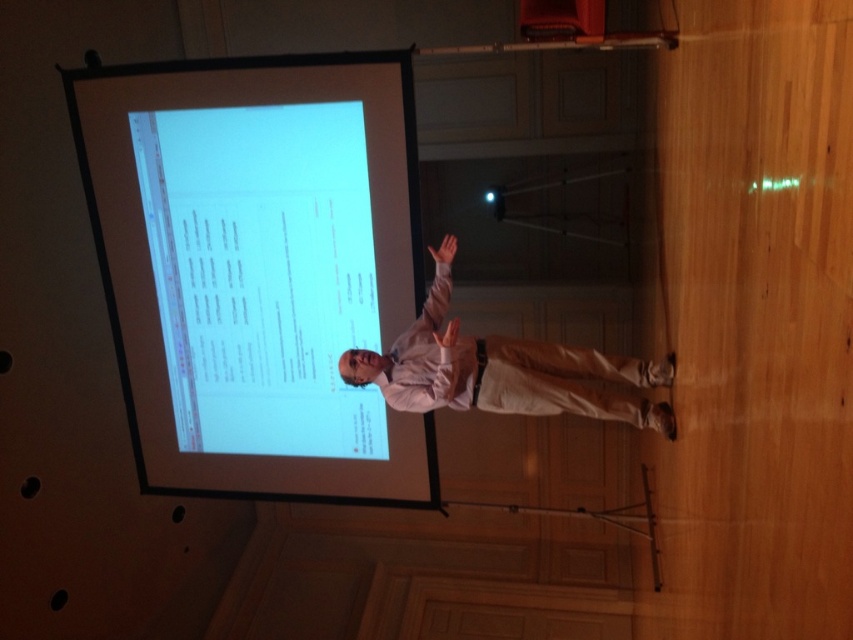
You are an event planner setting up a new projector. The projector needs to be placed at a position that can project onto the point marked as point (257, 268). Where should you aim the projector to hit the white glossy projection screen at upper center?

The point (257, 268) marks the white glossy projection screen at upper center, so you should aim the projector at the white glossy projection screen at upper center to hit the desired point.

You are an event coordinator setting up a new projector. The projector needs to be placed at point 0.5, 0.5 to ensure proper focus. Will the white glossy projection screen at upper center at its current position interfere with the projector setup?

The white glossy projection screen at upper center is positioned at point (257,268), which is different from the projector placement point (426,320). Therefore, the screen will not interfere with the projector setup.

From the picture: You are sitting in the audience and looking at the stage. There are two points marked on the projection screen. Which point is closer to you, point (271, 227) or point (436, 257)?

Point (271, 227) is closer to you because it is further to the viewer than point (436, 257).